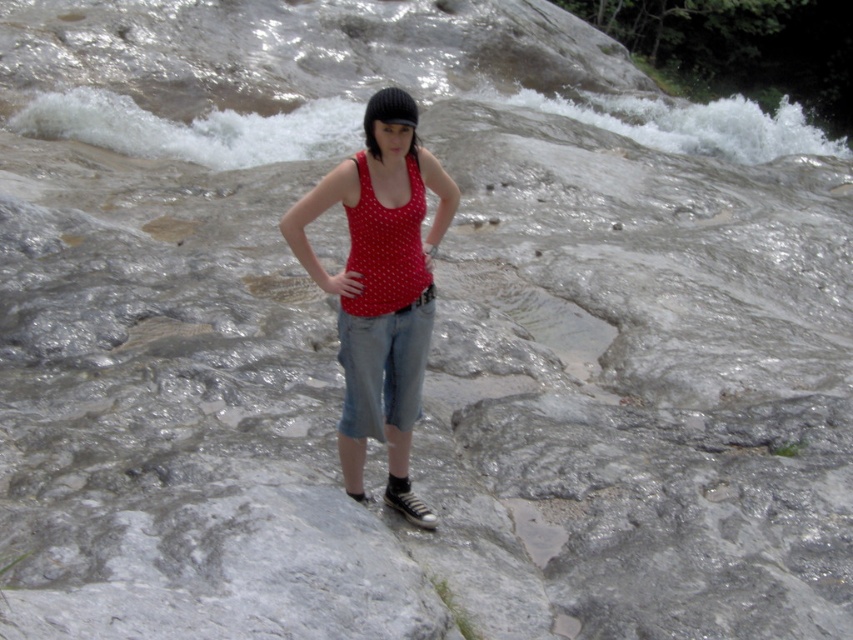
You are a photographer trying to capture the person in the image. You want to ensure both the polka dot fabric tank top at center and the red polka dot tank top at center are clearly visible in your shot. Given their sizes, which one might you need to adjust your focus on to ensure clarity?

The polka dot fabric tank top at center is taller than the red polka dot tank top at center, so you should focus on the taller one to ensure clarity.

You are a fashion designer observing a model wearing a polka dot fabric tank top at center and denim at center. Which clothing item appears taller on the model?

The polka dot fabric tank top at center is much taller than the denim at center, so the tank top appears taller on the model.